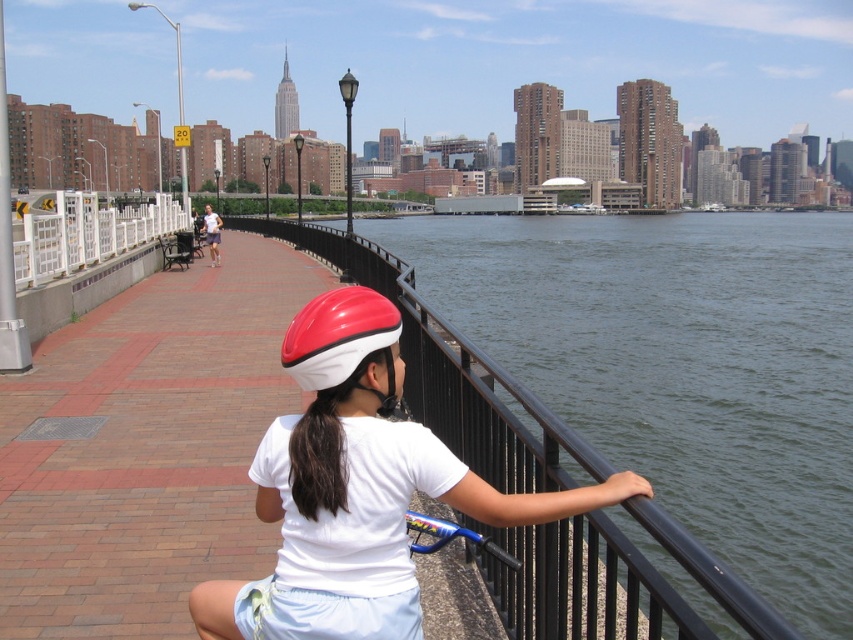
Question: Among these objects, which one is farthest from the camera?

Choices:
 (A) shiny plastic helmet at center
 (B) shiny red and white helmet at center

Answer: (B)

Question: Does dark green water at center have a lesser width compared to shiny red and white helmet at center?

Choices:
 (A) no
 (B) yes

Answer: (A)

Question: Which of the following is the closest to the observer?

Choices:
 (A) (738, 483)
 (B) (265, 433)
 (C) (384, 308)

Answer: (C)

Question: Does dark green water at center appear under shiny plastic helmet at center?

Choices:
 (A) yes
 (B) no

Answer: (B)

Question: Is dark green water at center below shiny plastic helmet at center?

Choices:
 (A) yes
 (B) no

Answer: (B)

Question: Which object is the farthest from the shiny red and white helmet at center?

Choices:
 (A) shiny plastic helmet at center
 (B) dark green water at center

Answer: (B)